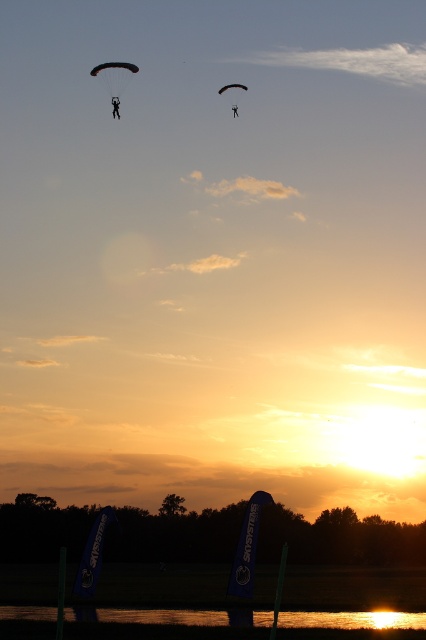
Question: Can you confirm if black matte parachute at upper center is thinner than black fabric parachute at upper center?

Choices:
 (A) yes
 (B) no

Answer: (B)

Question: Which point is farther to the camera?

Choices:
 (A) black fabric parachute at upper center
 (B) glistening water at lower center

Answer: (A)

Question: Is black matte parachute at upper left below black matte parachute at upper center?

Choices:
 (A) no
 (B) yes

Answer: (B)

Question: Among these objects, which one is farthest from the camera?

Choices:
 (A) black matte parachute at upper left
 (B) black parachute at upper center
 (C) black matte parachute at upper center
 (D) glistening water at lower center

Answer: (B)

Question: Can you confirm if glistening water at lower center is smaller than black matte parachute at upper left?

Choices:
 (A) no
 (B) yes

Answer: (B)

Question: Considering the real-world distances, which object is closest to the glistening water at lower center?

Choices:
 (A) black fabric parachute at upper center
 (B) black matte parachute at upper center
 (C) black matte parachute at upper left

Answer: (A)